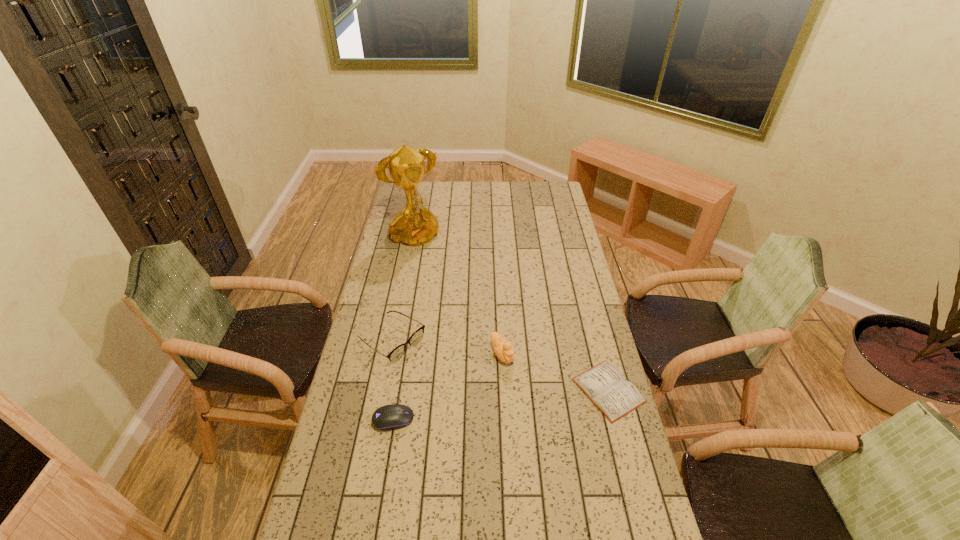
Locate an element on the screen. Image resolution: width=960 pixels, height=540 pixels. spectacles that is at the left edge is located at coordinates coord(416,337).

At what (x,y) coordinates should I click in order to perform the action: click on award at the left edge. Please return your answer as a coordinate pair (x, y). Looking at the image, I should click on (415, 225).

This screenshot has height=540, width=960. Find the location of `object at the right edge`. object at the right edge is located at coordinates (605, 386).

The image size is (960, 540). I want to click on free space at the far edge of the desktop, so click(x=448, y=188).

Locate an element on the screen. This screenshot has height=540, width=960. blank space at the left edge of the desktop is located at coordinates (413, 253).

In the image, there is a desktop. Identify the location of free space at the right edge. Image resolution: width=960 pixels, height=540 pixels. (543, 226).

What are the coordinates of `vacant area at the far right corner of the desktop` in the screenshot? It's located at (550, 190).

Image resolution: width=960 pixels, height=540 pixels. Find the location of `vacant region between the second object from right to left and the shortest object`. vacant region between the second object from right to left and the shortest object is located at coordinates [555, 372].

You are a GUI agent. You are given a task and a screenshot of the screen. Output one action in this format:
    pyautogui.click(x=<x>, y=<y>)
    Task: Click on the unoccupied position between the duckling and the spectacles
    The image size is (960, 540).
    Given the screenshot: What is the action you would take?
    pyautogui.click(x=446, y=347)

The width and height of the screenshot is (960, 540). Identify the location of free space between the second tallest object and the diary. point(555,372).